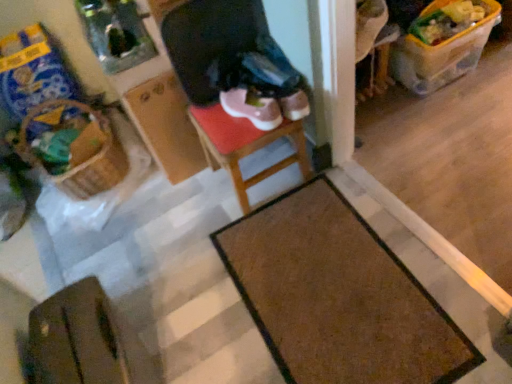
Question: From the image's perspective, would you say wooden stool at center is shown under brown woven basket at left?

Choices:
 (A) no
 (B) yes

Answer: (B)

Question: Can you confirm if wooden stool at center is bigger than brown woven basket at left?

Choices:
 (A) yes
 (B) no

Answer: (B)

Question: Is brown woven basket at left at the back of wooden stool at center?

Choices:
 (A) no
 (B) yes

Answer: (A)

Question: Is wooden stool at center shorter than brown woven basket at left?

Choices:
 (A) no
 (B) yes

Answer: (A)

Question: Is wooden stool at center thinner than brown woven basket at left?

Choices:
 (A) no
 (B) yes

Answer: (B)

Question: Does point (101, 345) appear closer or farther from the camera than point (256, 107)?

Choices:
 (A) closer
 (B) farther

Answer: (A)

Question: Looking at the image, does brown leather wallet at lower left seem bigger or smaller compared to pink suede sneakers at center?

Choices:
 (A) small
 (B) big

Answer: (B)

Question: Is brown leather wallet at lower left in front of or behind pink suede sneakers at center in the image?

Choices:
 (A) front
 (B) behind

Answer: (A)

Question: From the image's perspective, is brown leather wallet at lower left positioned above or below pink suede sneakers at center?

Choices:
 (A) above
 (B) below

Answer: (B)

Question: Considering their positions, is brown textured mat at lower center located in front of or behind brown leather wallet at lower left?

Choices:
 (A) behind
 (B) front

Answer: (A)

Question: From a real-world perspective, is brown textured mat at lower center physically located above or below brown leather wallet at lower left?

Choices:
 (A) above
 (B) below

Answer: (B)

Question: Is brown textured mat at lower center bigger or smaller than brown leather wallet at lower left?

Choices:
 (A) small
 (B) big

Answer: (A)

Question: Is point (326, 215) positioned closer to the camera than point (108, 369)?

Choices:
 (A) farther
 (B) closer

Answer: (A)

Question: Is brown woven basket at left to the left or to the right of wooden stool at center in the image?

Choices:
 (A) right
 (B) left

Answer: (B)

Question: From a real-world perspective, is brown woven basket at left positioned above or below wooden stool at center?

Choices:
 (A) below
 (B) above

Answer: (B)